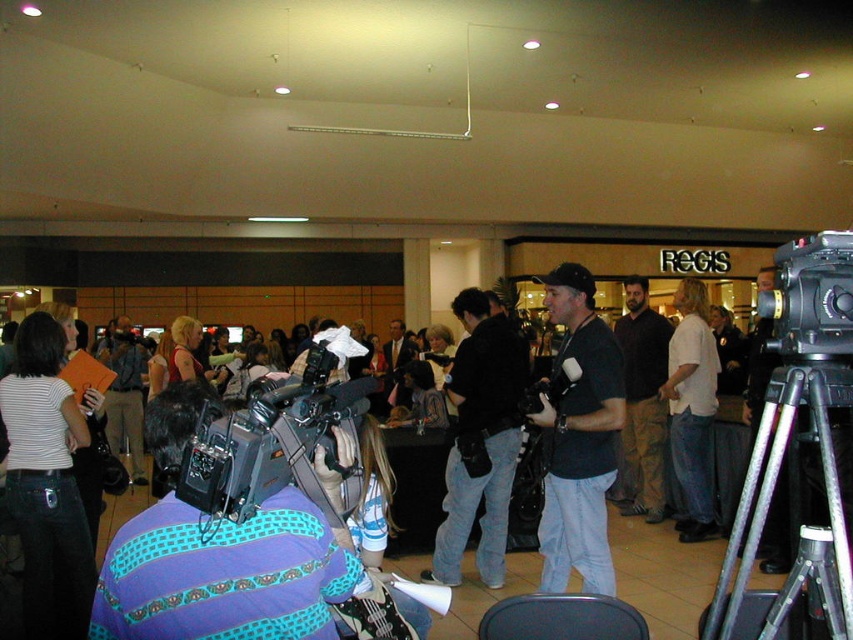
How far apart are black matte camera at right and matte black camera at center?

black matte camera at right and matte black camera at center are 20.69 feet apart from each other.

Can you confirm if black matte camera at right is positioned to the right of matte black camera at center?

Indeed, black matte camera at right is positioned on the right side of matte black camera at center.

Between point (763, 568) and point (142, 465), which one is positioned behind?

Positioned behind is point (142, 465).

The image size is (853, 640). I want to click on black matte camera at right, so click(x=758, y=374).

Measure the distance from black matte video camera at center to matte black camera at center.

black matte video camera at center is 6.88 meters from matte black camera at center.

Where is `black matte video camera at center`? black matte video camera at center is located at coordinates (277, 440).

Identify the location of black matte video camera at center. The width and height of the screenshot is (853, 640). point(277,440).

Does black leather jacket at center appear on the right side of black matte camera at right?

No, black leather jacket at center is not to the right of black matte camera at right.

Between point (467, 401) and point (775, 550), which one is positioned in front?

Point (467, 401)

Locate an element on the screen. black leather jacket at center is located at coordinates (480, 440).